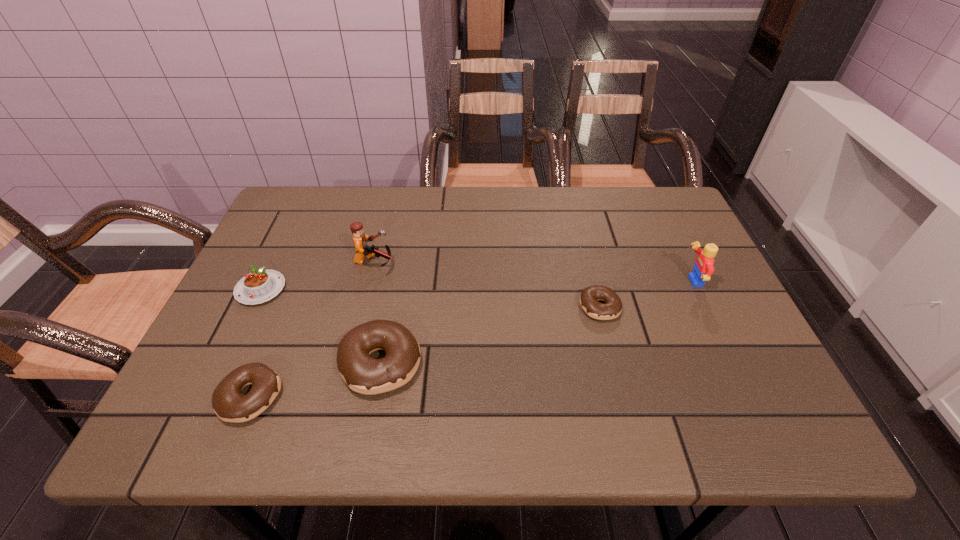
In order to click on vacant space in between the leftmost doughnut and the pudding in this screenshot , I will do `click(255, 343)`.

Where is `vacant area that lies between the left Lego and the leftmost doughnut`? The width and height of the screenshot is (960, 540). vacant area that lies between the left Lego and the leftmost doughnut is located at coordinates (312, 329).

The image size is (960, 540). Find the location of `vacant area that lies between the right Lego and the left Lego`. vacant area that lies between the right Lego and the left Lego is located at coordinates (533, 272).

Locate an element on the screen. The height and width of the screenshot is (540, 960). vacant region between the rightmost object and the pudding is located at coordinates (476, 286).

This screenshot has width=960, height=540. What are the coordinates of `free space that is in between the left Lego and the pudding` in the screenshot? It's located at (318, 275).

This screenshot has height=540, width=960. Identify the location of free area in between the tallest doughnut and the right Lego. (537, 322).

You are a GUI agent. You are given a task and a screenshot of the screen. Output one action in this format:
    pyautogui.click(x=<x>, y=<y>)
    Task: Click on the fourth closest object to the pudding
    Image resolution: width=960 pixels, height=540 pixels.
    Given the screenshot: What is the action you would take?
    pyautogui.click(x=589, y=297)

This screenshot has width=960, height=540. What are the coordinates of `object that stands as the third closest to the leftmost doughnut` in the screenshot? It's located at click(x=360, y=239).

This screenshot has width=960, height=540. In order to click on doughnut that stands as the third closest to the left Lego in this screenshot , I will do [x=589, y=297].

Locate which doughnut ranks in proximity to the rightmost object. Please provide its 2D coordinates. Your answer should be formatted as a tuple, i.e. [(x, y)], where the tuple contains the x and y coordinates of a point satisfying the conditions above.

[(589, 297)]